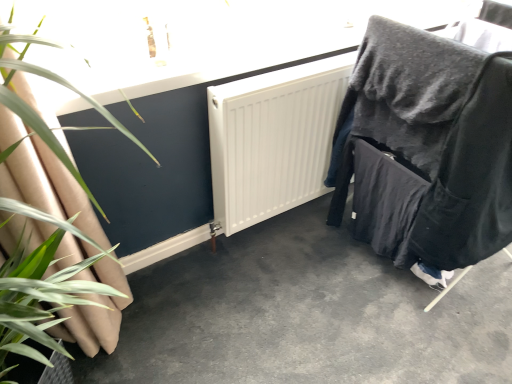
Question: Is velvet black chair at right bigger or smaller than smooth concrete floor at center?

Choices:
 (A) small
 (B) big

Answer: (B)

Question: Considering the positions of velvet black chair at right and smooth concrete floor at center in the image, is velvet black chair at right wider or thinner than smooth concrete floor at center?

Choices:
 (A) thin
 (B) wide

Answer: (A)

Question: Which is nearer to the velvet black chair at right?

Choices:
 (A) smooth concrete floor at center
 (B) green leafy plant at left

Answer: (A)

Question: Estimate the real-world distances between objects in this image. Which object is closer to the green leafy plant at left?

Choices:
 (A) velvet black chair at right
 (B) smooth concrete floor at center

Answer: (B)